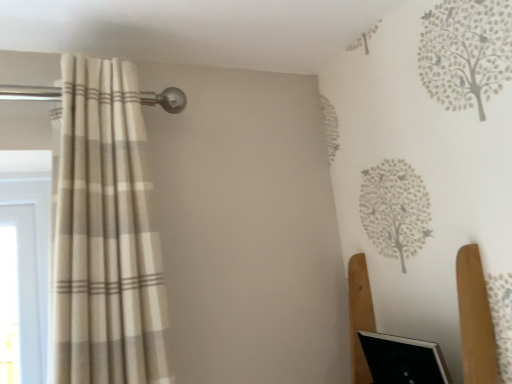
Locate an element on the screen. black glossy computer screen at lower right is located at coordinates (403, 360).

Describe the element at coordinates (403, 360) in the screenshot. I see `black glossy computer screen at lower right` at that location.

You are a GUI agent. You are given a task and a screenshot of the screen. Output one action in this format:
    pyautogui.click(x=<x>, y=<y>)
    Task: Click on the black glossy computer screen at lower right
    
    Given the screenshot: What is the action you would take?
    pyautogui.click(x=403, y=360)